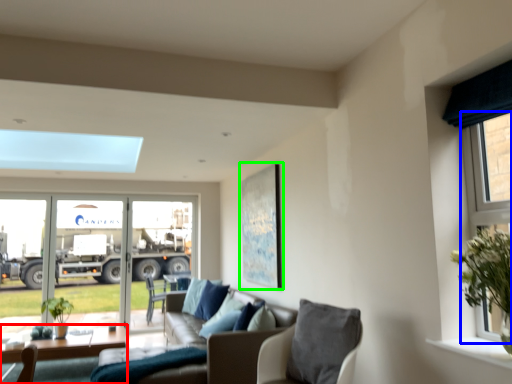
Question: Estimate the real-world distances between objects in this image. Which object is closer to table (highlighted by a red box), window (highlighted by a blue box) or picture frame (highlighted by a green box)?

Choices:
 (A) window
 (B) picture frame

Answer: (B)